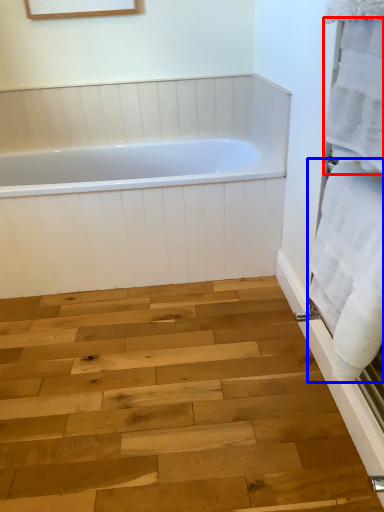
Question: Which point is further to the camera, bath towel (highlighted by a red box) or bath towel (highlighted by a blue box)?

Choices:
 (A) bath towel
 (B) bath towel

Answer: (B)